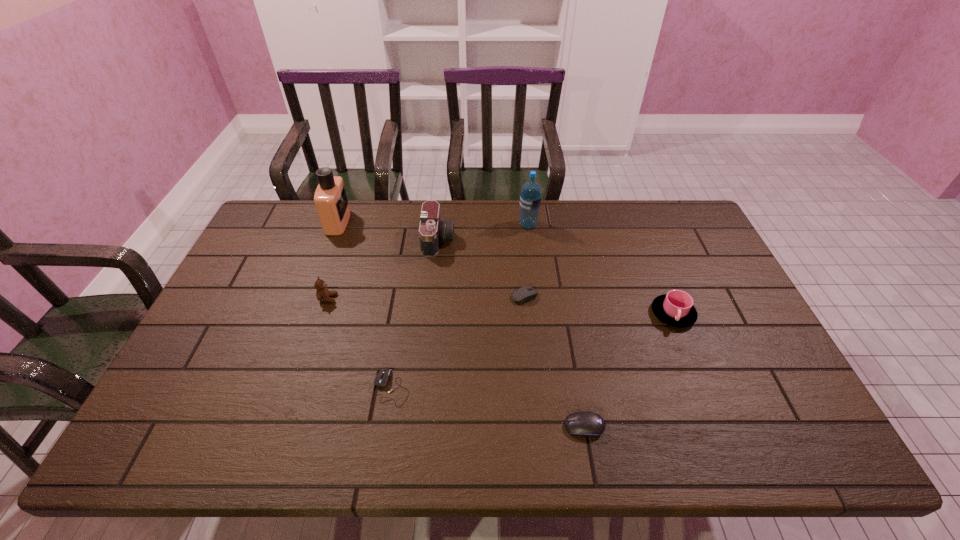
Choose which computer mouse is the second nearest neighbor to the fifth shortest object. Please provide its 2D coordinates. Your answer should be formatted as a tuple, i.e. [(x, y)], where the tuple contains the x and y coordinates of a point satisfying the conditions above.

[(526, 293)]

Locate which computer mouse is the second closest to the seventh farthest object. Please provide its 2D coordinates. Your answer should be formatted as a tuple, i.e. [(x, y)], where the tuple contains the x and y coordinates of a point satisfying the conditions above.

[(586, 423)]

Image resolution: width=960 pixels, height=540 pixels. In order to click on vacant position in the image that satisfies the following two spatial constraints: 1. on the front-facing side of the farthest computer mouse; 2. on the right side of the camera in this screenshot , I will do `click(433, 296)`.

Identify the location of free location that satisfies the following two spatial constraints: 1. on the front side of the shortest computer mouse; 2. on the left side of the rightmost computer mouse. (386, 427).